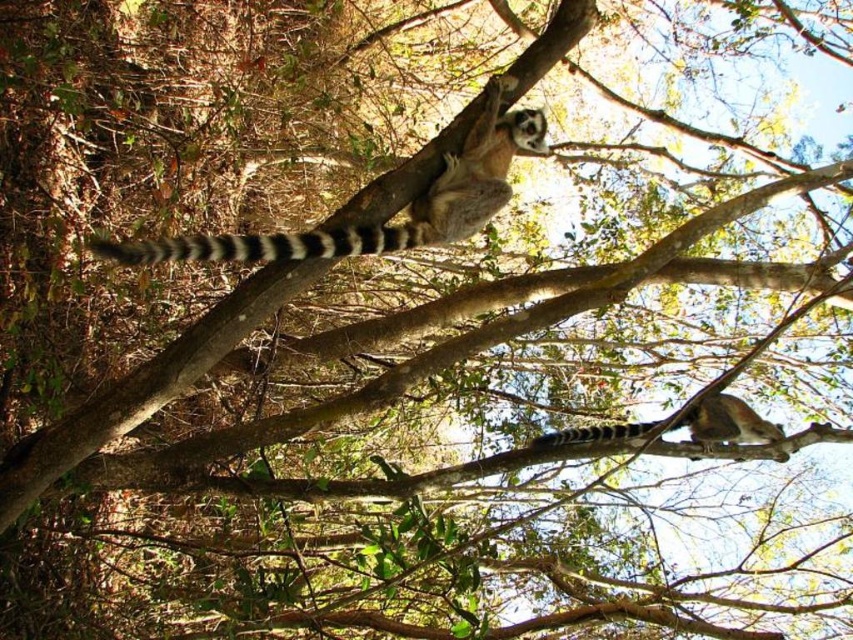
Question: Is ring-tailed fur at upper center thinner than white striped tail at upper center?

Choices:
 (A) yes
 (B) no

Answer: (B)

Question: Estimate the real-world distances between objects in this image. Which object is closer to the ring-tailed fur at upper center?

Choices:
 (A) ring-tailed fur at center
 (B) white striped tail at upper center

Answer: (B)

Question: Which object is the closest to the ring-tailed fur at center?

Choices:
 (A) ring-tailed fur at upper center
 (B) white striped tail at upper center

Answer: (A)

Question: Is ring-tailed fur at upper center wider than white striped tail at upper center?

Choices:
 (A) yes
 (B) no

Answer: (A)

Question: Which object appears closest to the camera in this image?

Choices:
 (A) white striped tail at upper center
 (B) ring-tailed fur at upper center
 (C) ring-tailed fur at center

Answer: (B)

Question: Does ring-tailed fur at upper center have a larger size compared to ring-tailed fur at center?

Choices:
 (A) no
 (B) yes

Answer: (B)